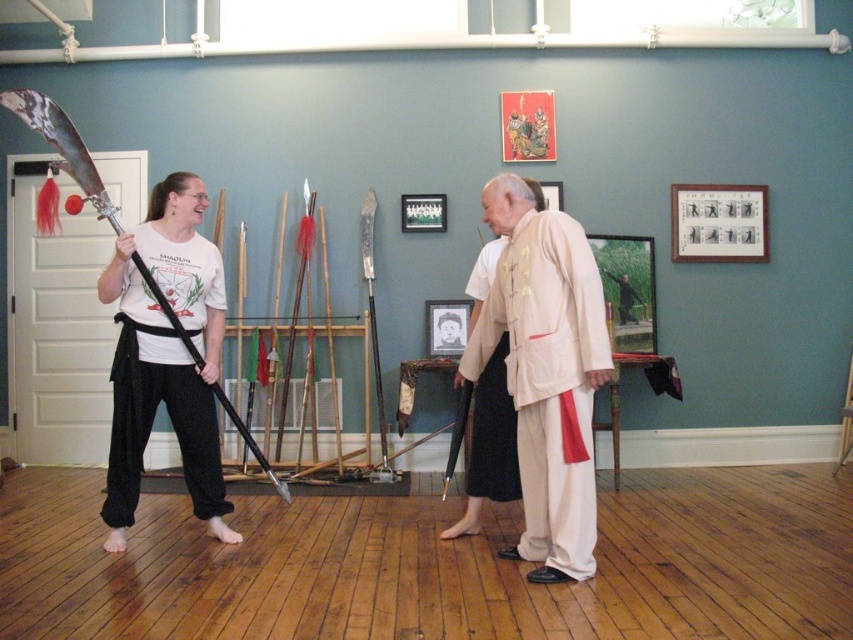
Question: Estimate the real-world distances between objects in this image. Which object is farther from the light beige silk robe at center?

Choices:
 (A) beige cotton robe at center
 (B) matte black sword at left

Answer: (A)

Question: In this image, where is matte black sword at left located relative to beige cotton robe at center?

Choices:
 (A) above
 (B) below

Answer: (A)

Question: Does beige cotton robe at center have a larger size compared to black cotton robe at left?

Choices:
 (A) no
 (B) yes

Answer: (B)

Question: Based on their relative distances, which object is nearer to the light beige silk robe at center?

Choices:
 (A) black cotton robe at left
 (B) beige cotton robe at center

Answer: (B)

Question: In this image, where is matte black sword at left located relative to black cotton robe at left?

Choices:
 (A) right
 (B) left

Answer: (A)

Question: Which object is the farthest from the beige cotton robe at center?

Choices:
 (A) light beige silk robe at center
 (B) matte black sword at left

Answer: (A)